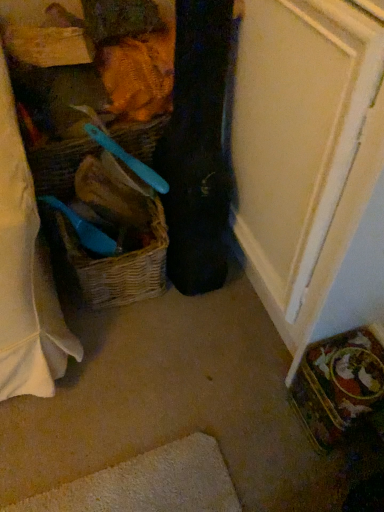
Where is `woven brown picnic basket at left`? woven brown picnic basket at left is located at coordinates (119, 265).

Can you confirm if woven straw basket at center is taller than black fabric guitar case at center?

Incorrect, the height of woven straw basket at center is not larger of that of black fabric guitar case at center.

Considering the relative positions of woven straw basket at center and black fabric guitar case at center in the image provided, is woven straw basket at center to the left of black fabric guitar case at center from the viewer's perspective?

Indeed, woven straw basket at center is positioned on the left side of black fabric guitar case at center.

Choose the correct answer: Is woven straw basket at center inside black fabric guitar case at center or outside it?

woven straw basket at center is not inside black fabric guitar case at center, it's outside.

Which of these two, woven straw basket at center or woven brown picnic basket at left, is wider?

Wider between the two is woven brown picnic basket at left.

Consider the image. From a real-world perspective, is woven straw basket at center physically located above or below woven brown picnic basket at left?

From a real-world perspective, woven straw basket at center is physically above woven brown picnic basket at left.

Who is smaller, woven straw basket at center or woven brown picnic basket at left?

woven straw basket at center.

Between woven straw basket at center and woven brown picnic basket at left, which one is positioned behind?

woven brown picnic basket at left is further from the camera.

Visually, is black fabric guitar case at center positioned to the left or to the right of woven brown picnic basket at left?

black fabric guitar case at center is positioned on woven brown picnic basket at left's right side.

Are black fabric guitar case at center and woven brown picnic basket at left located far from each other?

No, there isn't a large distance between black fabric guitar case at center and woven brown picnic basket at left.

Is black fabric guitar case at center positioned before woven brown picnic basket at left?

That is True.

From the image's perspective, relative to woven straw basket at center, is black fabric guitar case at center above or below?

From the image's perspective, black fabric guitar case at center appears below woven straw basket at center.

Are black fabric guitar case at center and woven straw basket at center located far from each other?

Actually, black fabric guitar case at center and woven straw basket at center are a little close together.

What's the angular difference between black fabric guitar case at center and woven straw basket at center's facing directions?

The angle between the facing direction of black fabric guitar case at center and the facing direction of woven straw basket at center is 142 degrees.

Based on the photo, can you confirm if black fabric guitar case at center is bigger than woven straw basket at center?

Indeed, black fabric guitar case at center has a larger size compared to woven straw basket at center.

How different are the orientations of woven brown picnic basket at left and woven straw basket at center in degrees?

56.9 degrees.

From the image's perspective, who appears lower, woven brown picnic basket at left or woven straw basket at center?

woven brown picnic basket at left, from the image's perspective.

Can you confirm if woven brown picnic basket at left is wider than woven straw basket at center?

Correct, the width of woven brown picnic basket at left exceeds that of woven straw basket at center.

Can you confirm if woven brown picnic basket at left is positioned to the left of woven straw basket at center?

Indeed, woven brown picnic basket at left is positioned on the left side of woven straw basket at center.

Is woven brown picnic basket at left wider than black fabric guitar case at center?

Yes, woven brown picnic basket at left is wider than black fabric guitar case at center.

Would you say woven brown picnic basket at left contains black fabric guitar case at center?

No, black fabric guitar case at center is not a part of woven brown picnic basket at left.

Is woven brown picnic basket at left behind black fabric guitar case at center?

Yes, woven brown picnic basket at left is further from the camera.

The image size is (384, 512). In order to click on clothing above the woven straw basket at center (from a real-world perspective) in this screenshot , I will do `click(197, 148)`.

This screenshot has width=384, height=512. I want to click on basket on the right of woven brown picnic basket at left, so [x=59, y=163].

Consider the image. Which object lies nearer to the anchor point woven brown picnic basket at left, woven straw basket at center or black fabric guitar case at center?

black fabric guitar case at center is positioned closer to the anchor woven brown picnic basket at left.

When comparing their distances from black fabric guitar case at center, does woven straw basket at center or woven brown picnic basket at left seem closer?

woven brown picnic basket at left is positioned closer to the anchor black fabric guitar case at center.

Estimate the real-world distances between objects in this image. Which object is further from woven straw basket at center, woven brown picnic basket at left or black fabric guitar case at center?

black fabric guitar case at center is further to woven straw basket at center.

Estimate the real-world distances between objects in this image. Which object is further from woven straw basket at center, black fabric guitar case at center or woven brown picnic basket at left?

Among the two, black fabric guitar case at center is located further to woven straw basket at center.

Based on their spatial positions, is black fabric guitar case at center or woven straw basket at center further from woven brown picnic basket at left?

woven straw basket at center.

Looking at the image, which one is located closer to black fabric guitar case at center, woven brown picnic basket at left or woven straw basket at center?

woven brown picnic basket at left is closer to black fabric guitar case at center.

Where is `basket positioned between black fabric guitar case at center and woven brown picnic basket at left from near to far`? This screenshot has width=384, height=512. basket positioned between black fabric guitar case at center and woven brown picnic basket at left from near to far is located at coordinates (59, 163).